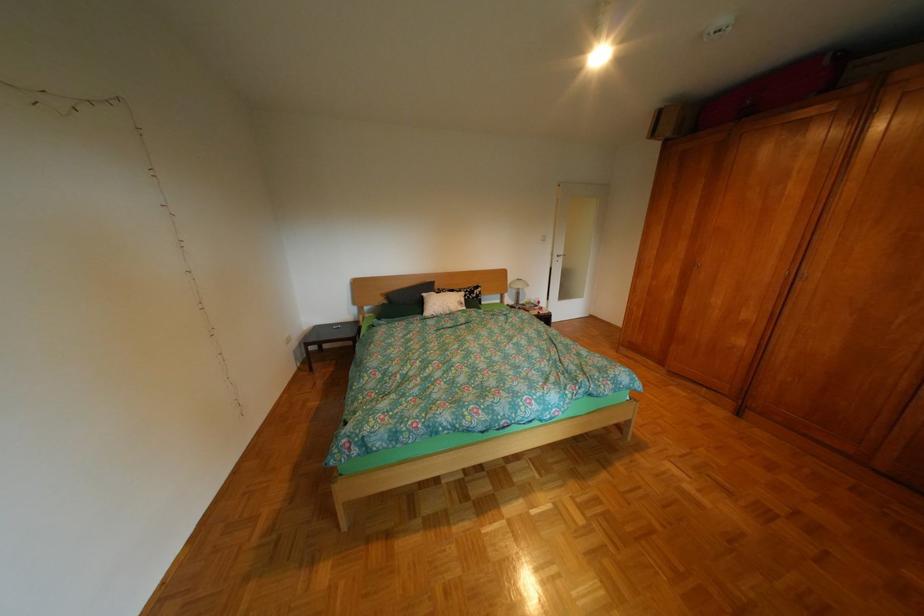
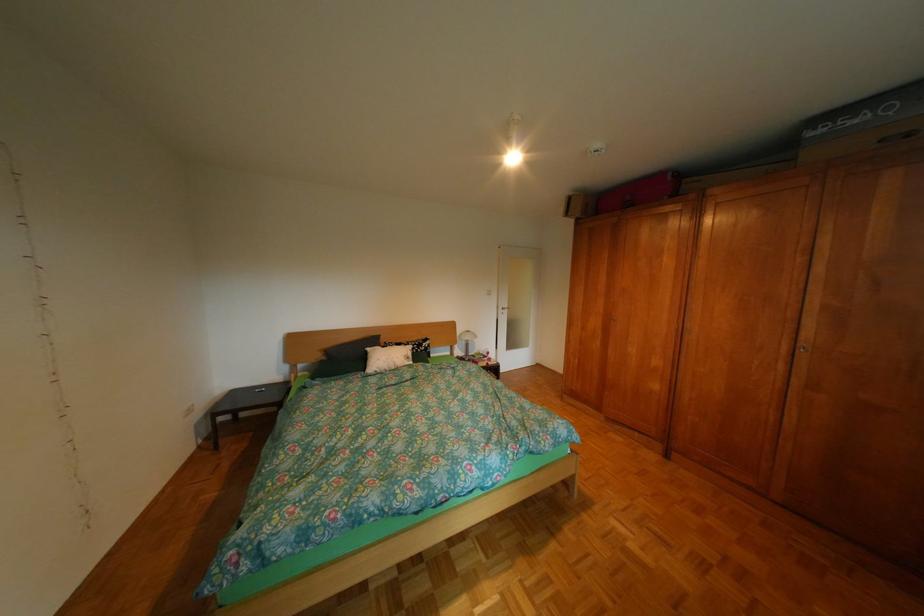
Question: In a continuous first-person perspective shot, in which direction is the camera moving?

Choices:
 (A) Left
 (B) Right
 (C) Forward
 (D) Backward

Answer: (B)